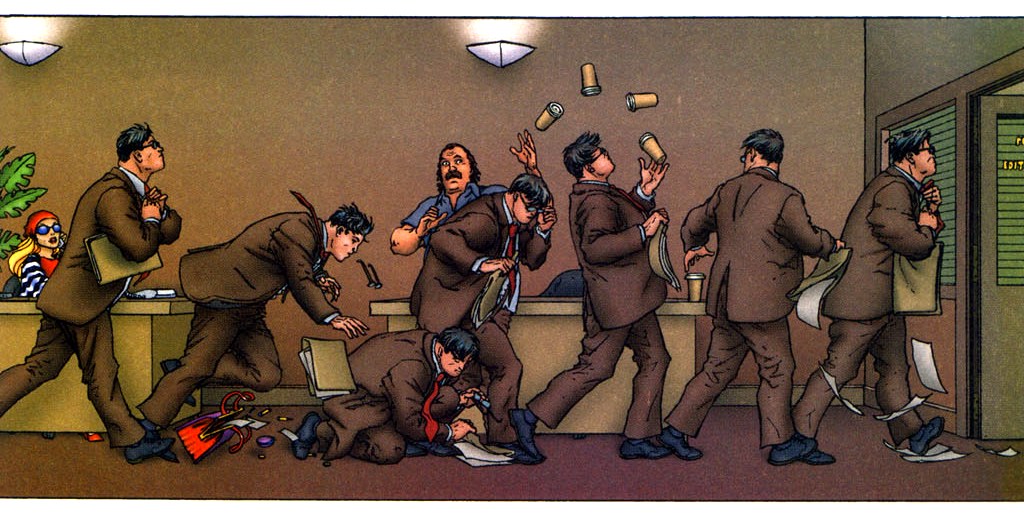
Locate an element on the screen. This screenshot has height=513, width=1024. door is located at coordinates (1000, 315).